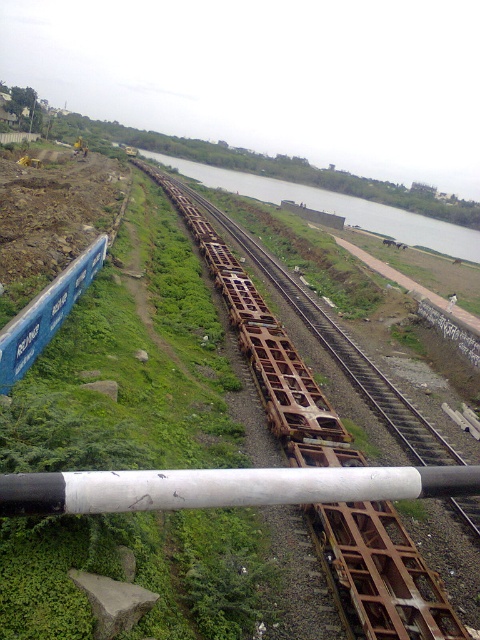
Does white matte pole at center have a greater height compared to blue matte freight car at left?

In fact, white matte pole at center may be shorter than blue matte freight car at left.

Looking at this image, is white matte pole at center bigger than blue matte freight car at left?

No, white matte pole at center is not bigger than blue matte freight car at left.

Does point (64, 477) lie behind point (51, 296)?

No, (64, 477) is in front of (51, 296).

At what (x,y) coordinates should I click in order to perform the action: click on white matte pole at center. Please return your answer as a coordinate pair (x, y). Looking at the image, I should click on (225, 486).

Does point (276, 474) lie behind point (347, 202)?

No, (276, 474) is closer to viewer.

Who is lower down, white matte pole at center or green grassy river at center?

white matte pole at center is lower down.

Identify the location of white matte pole at center. Image resolution: width=480 pixels, height=640 pixels. (225, 486).

The height and width of the screenshot is (640, 480). I want to click on white matte pole at center, so click(x=225, y=486).

Based on the photo, is the position of green grassy river at center less distant than that of blue matte freight car at left?

No, it is behind blue matte freight car at left.

Is green grassy river at center wider than blue matte freight car at left?

Yes.

Is point (361, 204) in front of point (40, 298)?

No.

Locate an element on the screen. The image size is (480, 640). green grassy river at center is located at coordinates (336, 205).